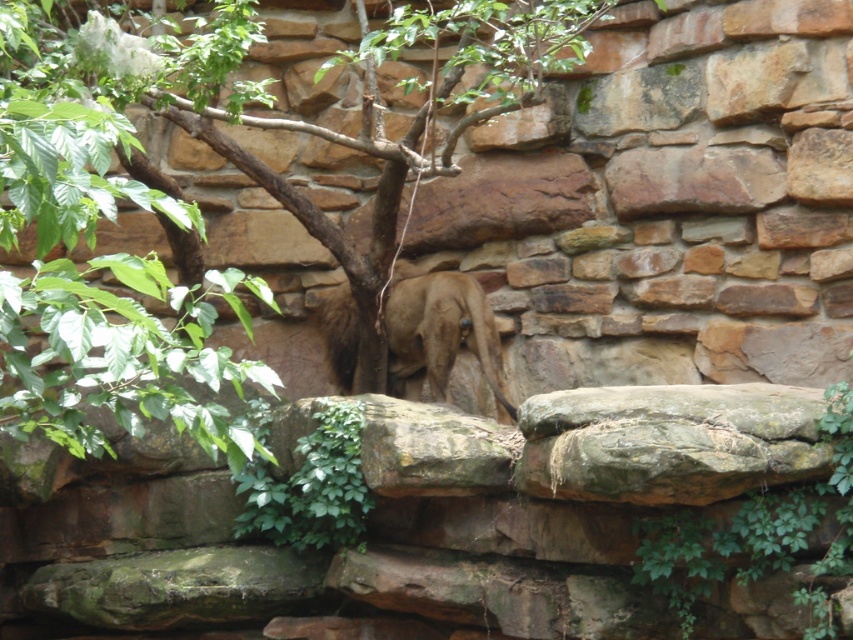
This screenshot has height=640, width=853. Find the location of `green leafy tree at center`. green leafy tree at center is located at coordinates (225, 157).

Does green leafy tree at center appear over brown fur at center?

Indeed, green leafy tree at center is positioned over brown fur at center.

Identify the location of green leafy tree at center. This screenshot has width=853, height=640. (225, 157).

Identify the location of green leafy tree at center. (225, 157).